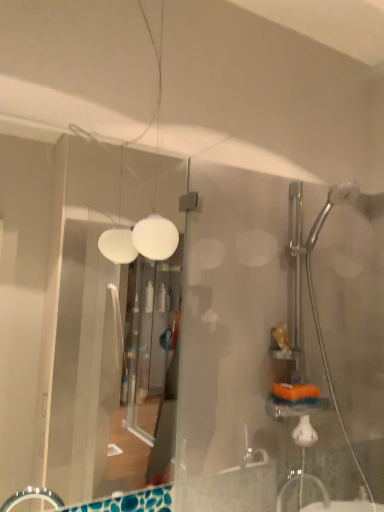
Question: From a real-world perspective, relative to transparent glass door at left, is white matte light fixture at upper center vertically above or below?

Choices:
 (A) below
 (B) above

Answer: (B)

Question: Is point click(x=167, y=253) closer or farther from the camera than point click(x=117, y=452)?

Choices:
 (A) closer
 (B) farther

Answer: (A)

Question: Which is correct: white matte light fixture at upper center is inside transparent glass door at left, or outside of it?

Choices:
 (A) outside
 (B) inside

Answer: (A)

Question: From their relative heights in the image, would you say transparent glass door at left is taller or shorter than white matte light fixture at upper center?

Choices:
 (A) short
 (B) tall

Answer: (B)

Question: Is transparent glass door at left inside the boundaries of white matte light fixture at upper center, or outside?

Choices:
 (A) outside
 (B) inside

Answer: (A)

Question: Visually, is transparent glass door at left positioned to the left or to the right of white matte light fixture at upper center?

Choices:
 (A) left
 (B) right

Answer: (A)

Question: Considering the positions of transparent glass door at left and white matte light fixture at upper center in the image, is transparent glass door at left bigger or smaller than white matte light fixture at upper center?

Choices:
 (A) big
 (B) small

Answer: (A)